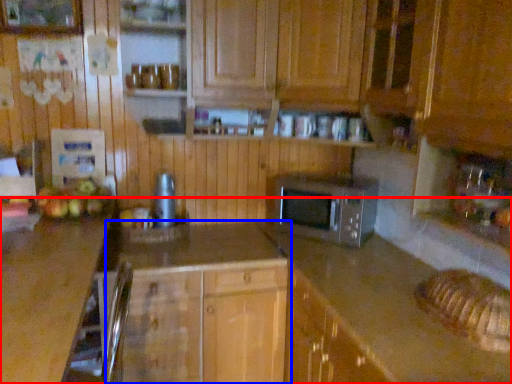
Question: Among these objects, which one is farthest to the camera, countertop (highlighted by a red box) or cabinetry (highlighted by a blue box)?

Choices:
 (A) countertop
 (B) cabinetry

Answer: (B)